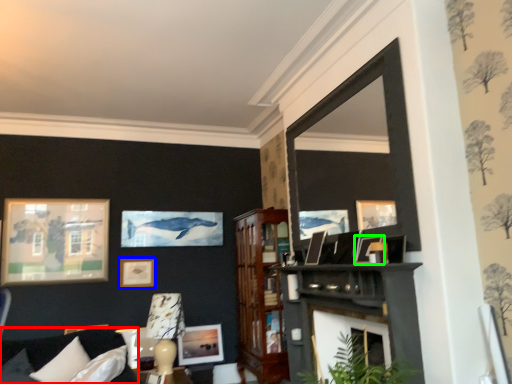
Question: Which is farther away from couch (highlighted by a red box)? picture frame (highlighted by a blue box) or picture frame (highlighted by a green box)?

Choices:
 (A) picture frame
 (B) picture frame

Answer: (B)